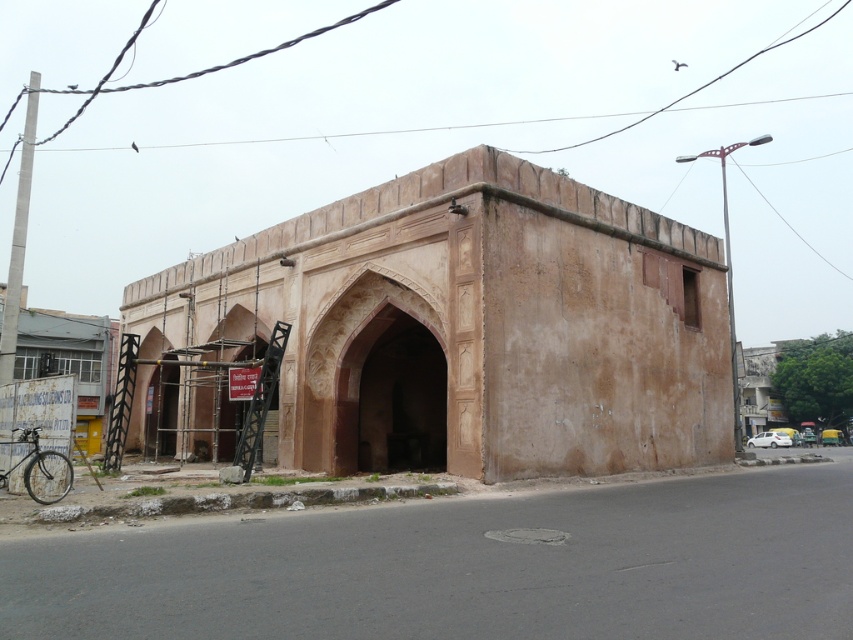
Does brown rough stone archway at center lie behind brown stone archway at center?

No, it is in front of brown stone archway at center.

Which of these two, brown rough stone archway at center or brown stone archway at center, stands shorter?

brown stone archway at center

Between point (448, 340) and point (344, 310), which one is positioned in front?

Point (448, 340)

Identify the location of brown rough stone archway at center. (469, 326).

Is point (172, 387) farther from viewer compared to point (4, 481)?

Yes.

Between point (311, 316) and point (28, 493), which one is positioned behind?

The point (311, 316) is more distant.

At what (x,y) coordinates should I click in order to perform the action: click on brown rough stone archway at center. Please return your answer as a coordinate pair (x, y). The height and width of the screenshot is (640, 853). Looking at the image, I should click on (469, 326).

Who is taller, brown stone archway at center or black matte bicycle at lower left?

brown stone archway at center

The image size is (853, 640). What are the coordinates of `brown stone archway at center` in the screenshot? It's located at (375, 381).

The width and height of the screenshot is (853, 640). I want to click on brown stone archway at center, so click(375, 381).